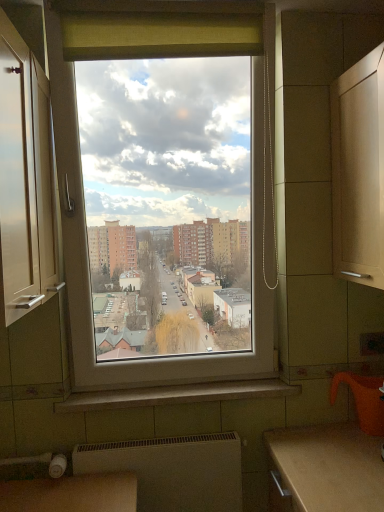
Question: Is white glossy cabinet at left taller than white matte radiator at lower center?

Choices:
 (A) no
 (B) yes

Answer: (B)

Question: Is white glossy cabinet at left shorter than white matte radiator at lower center?

Choices:
 (A) yes
 (B) no

Answer: (B)

Question: From a real-world perspective, is white glossy cabinet at left physically below white matte radiator at lower center?

Choices:
 (A) yes
 (B) no

Answer: (B)

Question: Could you tell me if white glossy cabinet at left is turned towards white matte radiator at lower center?

Choices:
 (A) no
 (B) yes

Answer: (A)

Question: From the image's perspective, is white glossy cabinet at left on top of white matte radiator at lower center?

Choices:
 (A) no
 (B) yes

Answer: (B)

Question: Would you say white glossy cabinet at left is inside or outside white matte radiator at lower center?

Choices:
 (A) outside
 (B) inside

Answer: (A)

Question: From a real-world perspective, is white glossy cabinet at left above or below white matte radiator at lower center?

Choices:
 (A) below
 (B) above

Answer: (B)

Question: Considering their positions, is white glossy cabinet at left located in front of or behind white matte radiator at lower center?

Choices:
 (A) behind
 (B) front

Answer: (B)

Question: Is white glossy cabinet at left bigger or smaller than white matte radiator at lower center?

Choices:
 (A) small
 (B) big

Answer: (B)

Question: Considering the positions of point (155, 400) and point (152, 460), is point (155, 400) closer or farther from the camera than point (152, 460)?

Choices:
 (A) closer
 (B) farther

Answer: (B)

Question: In terms of height, does white glossy window sill at center look taller or shorter compared to white matte radiator at lower center?

Choices:
 (A) short
 (B) tall

Answer: (A)

Question: In terms of width, does white glossy window sill at center look wider or thinner when compared to white matte radiator at lower center?

Choices:
 (A) wide
 (B) thin

Answer: (A)

Question: In the image, is white glossy window sill at center positioned in front of or behind white matte radiator at lower center?

Choices:
 (A) behind
 (B) front

Answer: (A)

Question: Visually, is white glossy cabinet at left positioned to the left or to the right of white glossy window sill at center?

Choices:
 (A) left
 (B) right

Answer: (A)

Question: Does point (11, 92) appear closer or farther from the camera than point (91, 409)?

Choices:
 (A) farther
 (B) closer

Answer: (B)